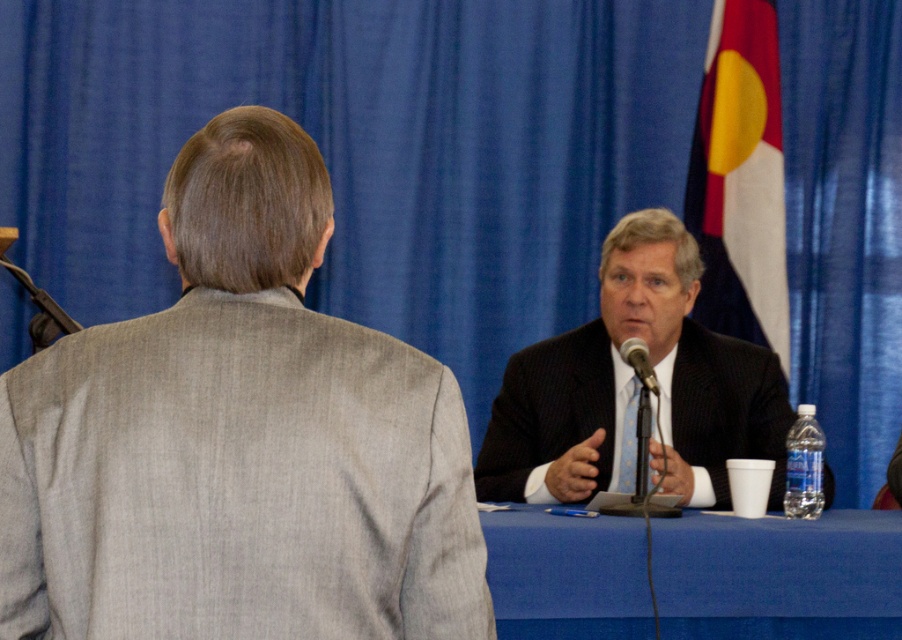
Question: Is dark suit at center wider than metallic silver microphone at center?

Choices:
 (A) no
 (B) yes

Answer: (B)

Question: Which object is positioned closest to the gray textured suit at upper left?

Choices:
 (A) metallic silver microphone at center
 (B) white fabric flag at upper right

Answer: (A)

Question: From the image, what is the correct spatial relationship of gray textured suit at upper left in relation to metallic silver microphone at center?

Choices:
 (A) right
 (B) left

Answer: (B)

Question: Estimate the real-world distances between objects in this image. Which object is farther from the gray textured suit at upper left?

Choices:
 (A) white fabric flag at upper right
 (B) blue fabric table at center

Answer: (A)

Question: Does dark suit at center have a greater width compared to blue fabric table at center?

Choices:
 (A) yes
 (B) no

Answer: (B)

Question: Estimate the real-world distances between objects in this image. Which object is farther from the white fabric flag at upper right?

Choices:
 (A) blue fabric table at center
 (B) gray textured suit at upper left
 (C) dark suit at center
 (D) metallic silver microphone at center

Answer: (B)